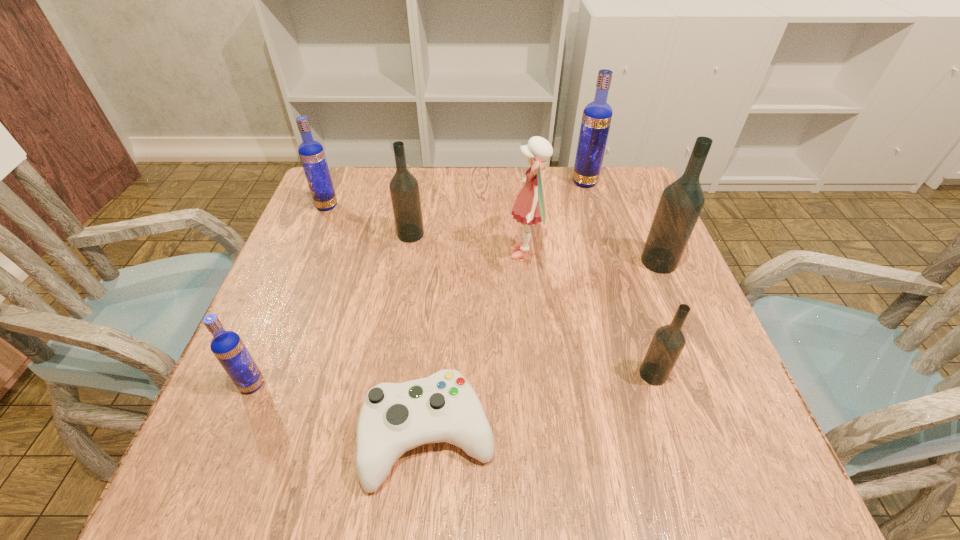
Identify the location of vacant area situated 0.060m on the right of the second smallest blue vodka. Image resolution: width=960 pixels, height=540 pixels. (361, 206).

Locate an element on the screen. The width and height of the screenshot is (960, 540). vacant space located 0.220m on the left of the fourth vodka from right to left is located at coordinates (306, 234).

Identify the location of free space located 0.060m on the front of the nearest blue vodka. The height and width of the screenshot is (540, 960). (234, 428).

You are a GUI agent. You are given a task and a screenshot of the screen. Output one action in this format:
    pyautogui.click(x=<x>, y=<y>)
    Task: Click on the vacant region located on the left of the second black vodka from left to right
    The image size is (960, 540).
    Given the screenshot: What is the action you would take?
    pyautogui.click(x=550, y=374)

The image size is (960, 540). Find the location of `blank area located on the left of the shortest object`. blank area located on the left of the shortest object is located at coordinates (202, 436).

Where is `object positioned at the near edge`? The image size is (960, 540). object positioned at the near edge is located at coordinates (394, 418).

Where is `object located at the far left corner`? Image resolution: width=960 pixels, height=540 pixels. object located at the far left corner is located at coordinates (311, 153).

The width and height of the screenshot is (960, 540). In order to click on object that is positioned at the far right corner in this screenshot , I will do `click(596, 119)`.

Identify the location of vacant area at the far edge. [x=463, y=175].

Locate an element on the screen. vacant region at the left edge of the desktop is located at coordinates (283, 276).